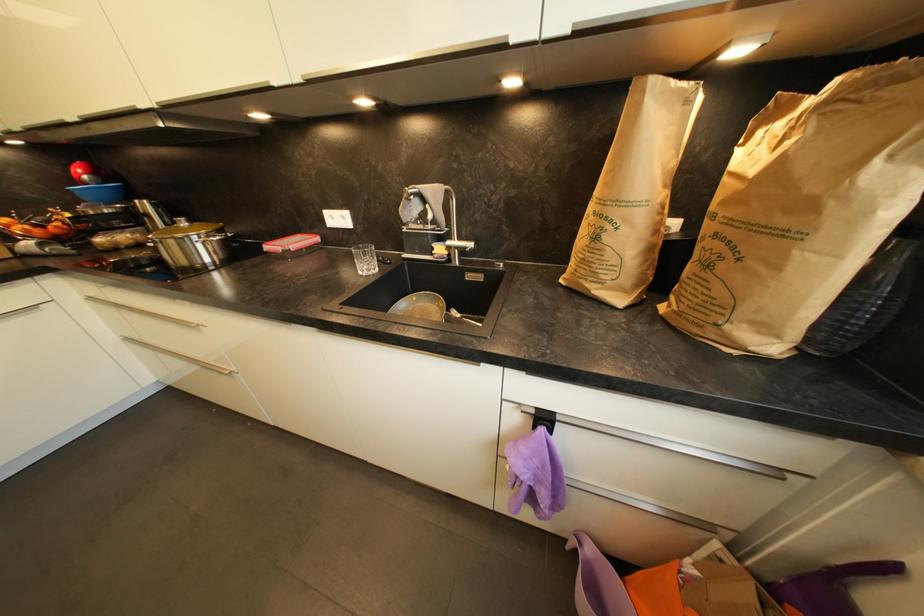
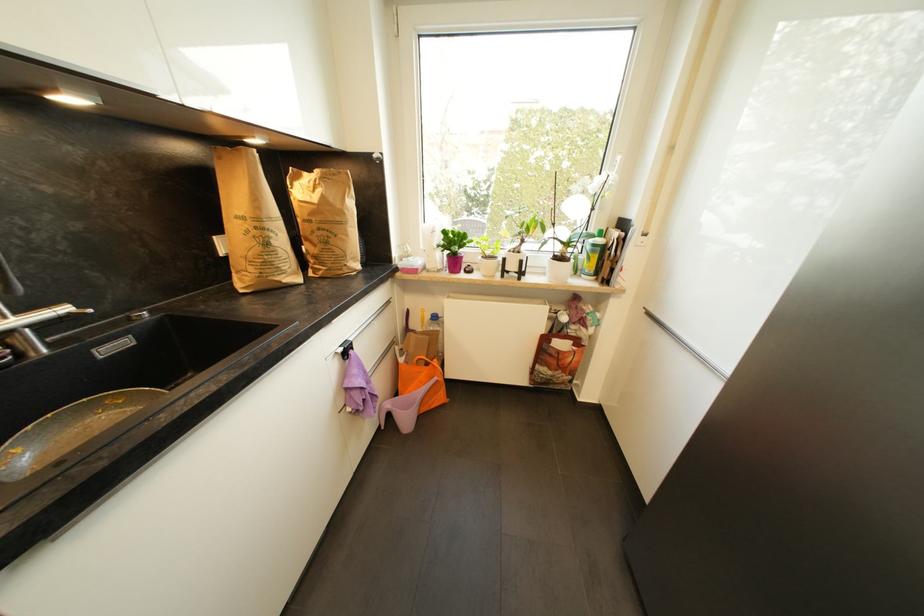
The point at (730, 204) is marked in the first image. Where is the corresponding point in the second image?

(317, 216)